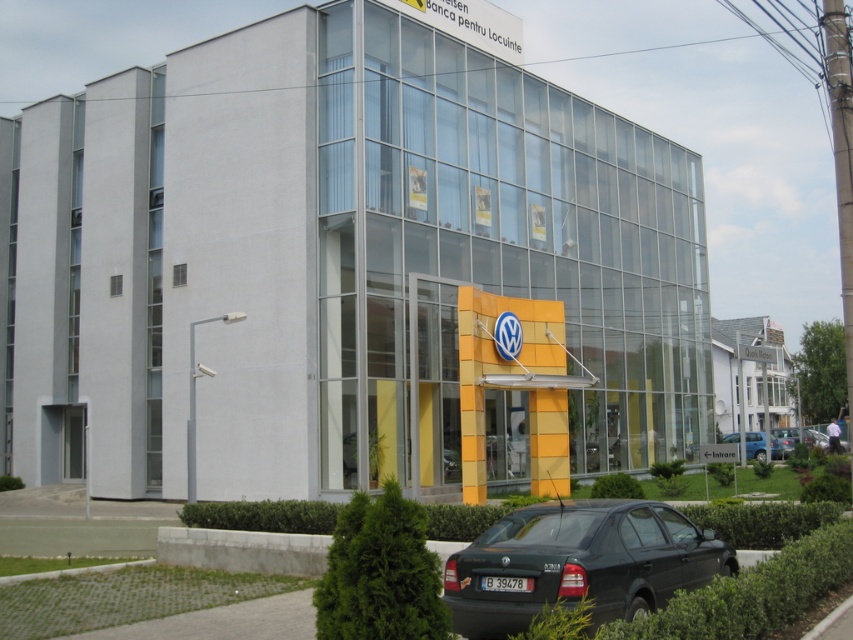
Question: Considering the real-world distances, which object is closest to the metallic silver sedan at lower right?

Choices:
 (A) black matte sedan at lower center
 (B) blue metallic car at lower right

Answer: (B)

Question: Is black matte sedan at lower center further to camera compared to blue metallic car at lower right?

Choices:
 (A) no
 (B) yes

Answer: (A)

Question: Based on their relative distances, which object is nearer to the metallic silver sedan at lower right?

Choices:
 (A) blue metallic car at lower right
 (B) black matte sedan at lower center

Answer: (A)

Question: Does blue metallic car at lower right appear on the right side of metallic silver sedan at lower right?

Choices:
 (A) no
 (B) yes

Answer: (A)

Question: Which object is positioned closest to the metallic silver sedan at lower right?

Choices:
 (A) black matte sedan at lower center
 (B) blue metallic car at lower right

Answer: (B)

Question: Can you confirm if black matte sedan at lower center is positioned to the right of metallic silver sedan at lower right?

Choices:
 (A) no
 (B) yes

Answer: (A)